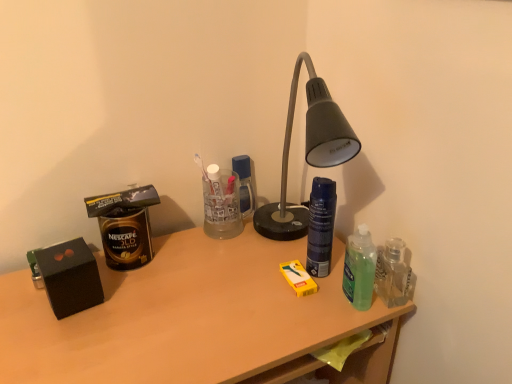
Identify the location of free space above matte black box at left (from a real-world perspective). This screenshot has height=384, width=512. (184, 291).